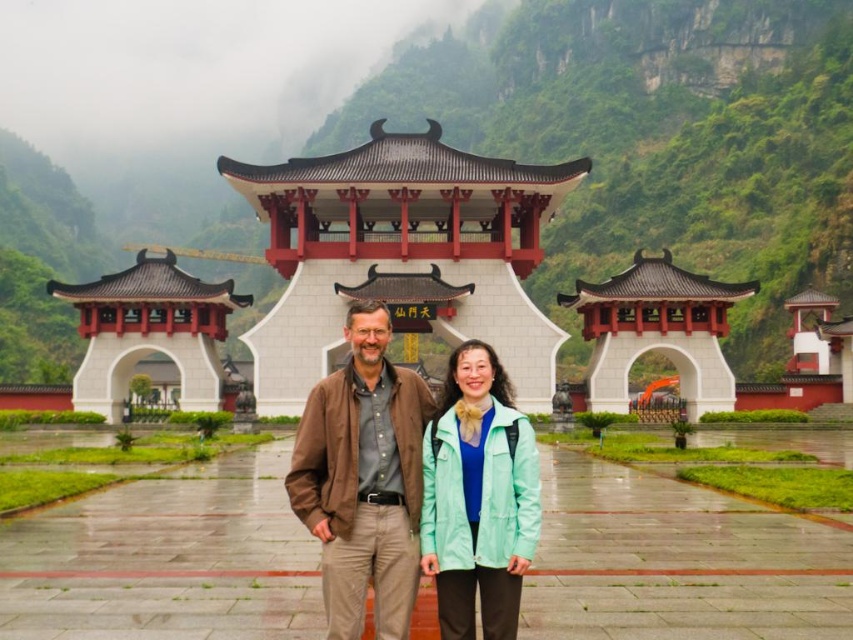
Question: Which object is farther from the camera taking this photo?

Choices:
 (A) brown leather jacket at center
 (B) mint green fabric jacket at center

Answer: (B)

Question: Considering the relative positions of brown leather jacket at center and mint green fabric jacket at center in the image provided, where is brown leather jacket at center located with respect to mint green fabric jacket at center?

Choices:
 (A) right
 (B) left

Answer: (B)

Question: Is brown leather jacket at center bigger than mint green fabric jacket at center?

Choices:
 (A) yes
 (B) no

Answer: (A)

Question: Does brown leather jacket at center appear under mint green fabric jacket at center?

Choices:
 (A) yes
 (B) no

Answer: (B)